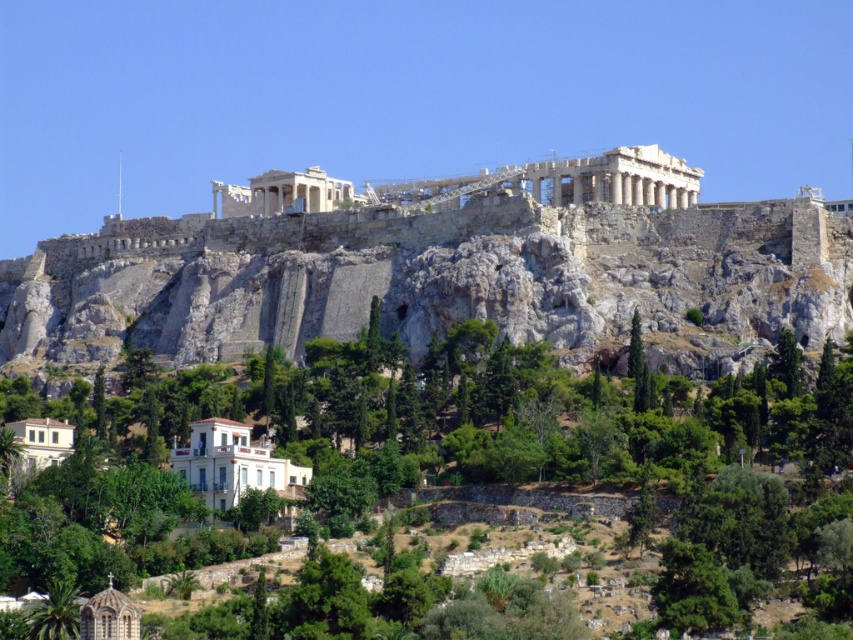
Question: Can you confirm if rugged stone mountain at center is positioned above green leafy tree at center?

Choices:
 (A) yes
 (B) no

Answer: (A)

Question: Which of the following is the closest to the observer?

Choices:
 (A) (734, 330)
 (B) (329, 355)

Answer: (A)

Question: Which point appears farthest from the camera in this image?

Choices:
 (A) (82, 380)
 (B) (683, 275)

Answer: (A)

Question: Is rugged stone mountain at center below green leafy tree at center?

Choices:
 (A) yes
 (B) no

Answer: (B)

Question: Is rugged stone mountain at center to the left of green leafy tree at center from the viewer's perspective?

Choices:
 (A) no
 (B) yes

Answer: (B)

Question: Among these points, which one is farthest from the camera?

Choices:
 (A) (833, 612)
 (B) (143, 285)

Answer: (B)